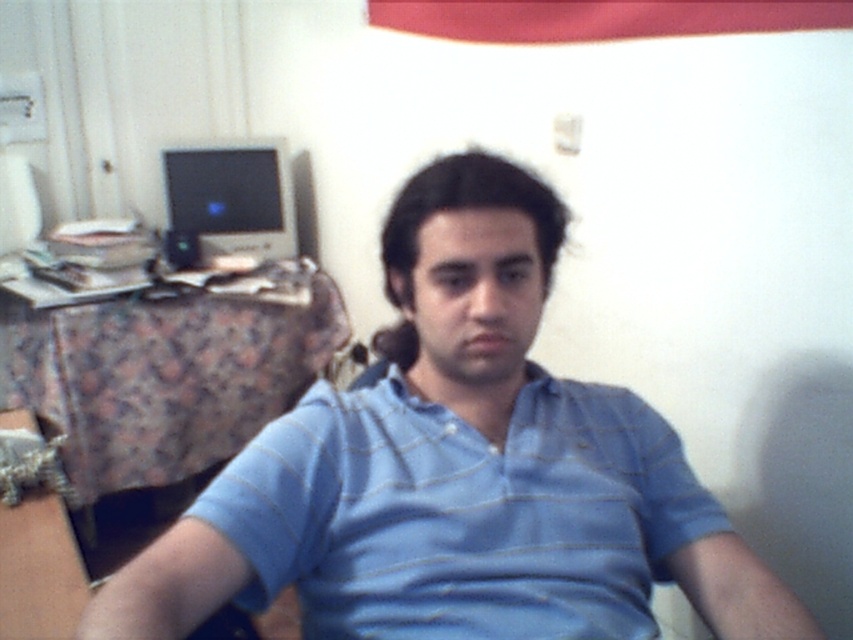
Question: Is blue striped shirt at center to the left of matte black monitor at left from the viewer's perspective?

Choices:
 (A) no
 (B) yes

Answer: (A)

Question: Which point is closer to the camera?

Choices:
 (A) matte black monitor at left
 (B) blue striped polo shirt at center

Answer: (B)

Question: Which of these objects is positioned closest to the blue striped polo shirt at center?

Choices:
 (A) matte black monitor at left
 (B) blue striped shirt at center

Answer: (B)

Question: Observing the image, what is the correct spatial positioning of blue striped shirt at center in reference to blue striped polo shirt at center?

Choices:
 (A) below
 (B) above

Answer: (B)

Question: Which point is closer to the camera taking this photo?

Choices:
 (A) (693, 520)
 (B) (318, 384)

Answer: (A)

Question: Is blue striped shirt at center in front of matte black monitor at left?

Choices:
 (A) no
 (B) yes

Answer: (B)